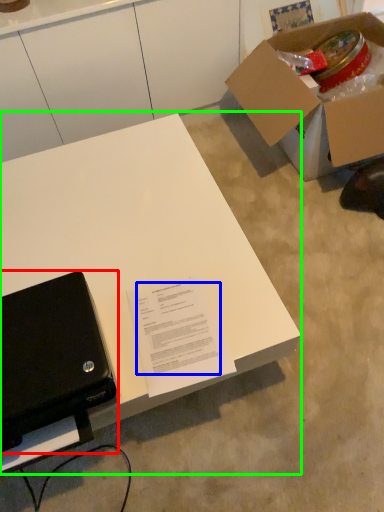
Question: Which object is the closest to the laptop (highlighted by a red box)? Choose among these: writing (highlighted by a blue box) or desk (highlighted by a green box).

Choices:
 (A) writing
 (B) desk

Answer: (A)